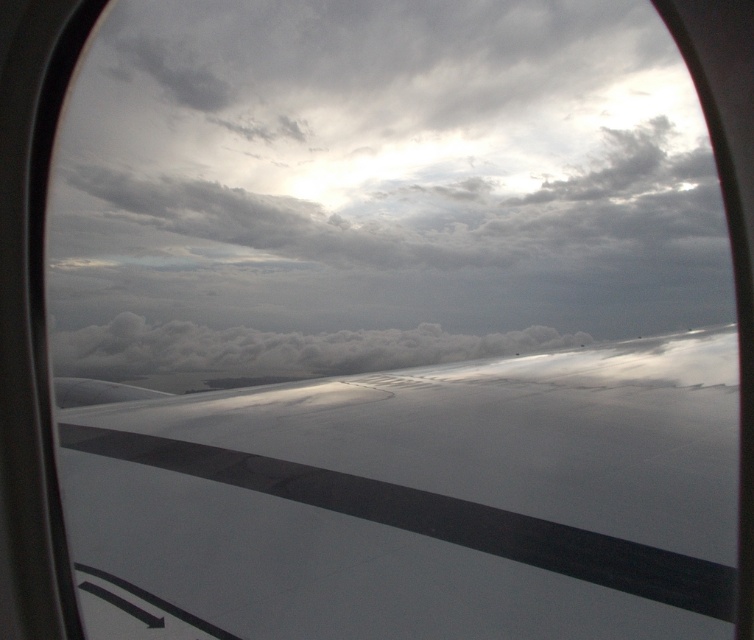
You are a passenger sitting near the window and notice the white glossy wing at center and the white fluffy cloud at center outside. Which object appears narrower when viewed from your seat?

The white glossy wing at center appears narrower than the white fluffy cloud at center because it is thinner.

You are a passenger sitting by the window and notice the white glossy wing at center and the white fluffy cloud at center outside. Which object is closer to you?

The white glossy wing at center is closer to you because it is in front of the white fluffy cloud at center.